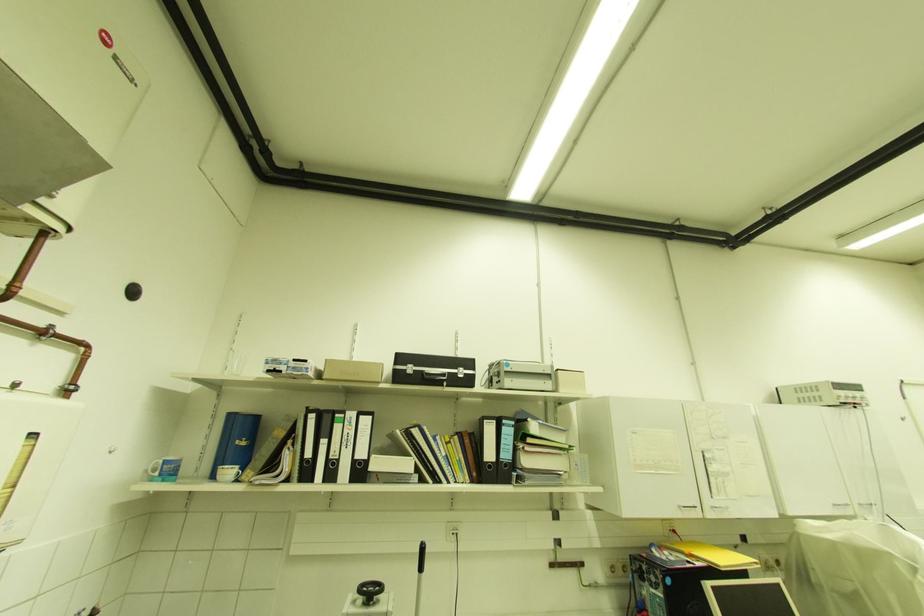
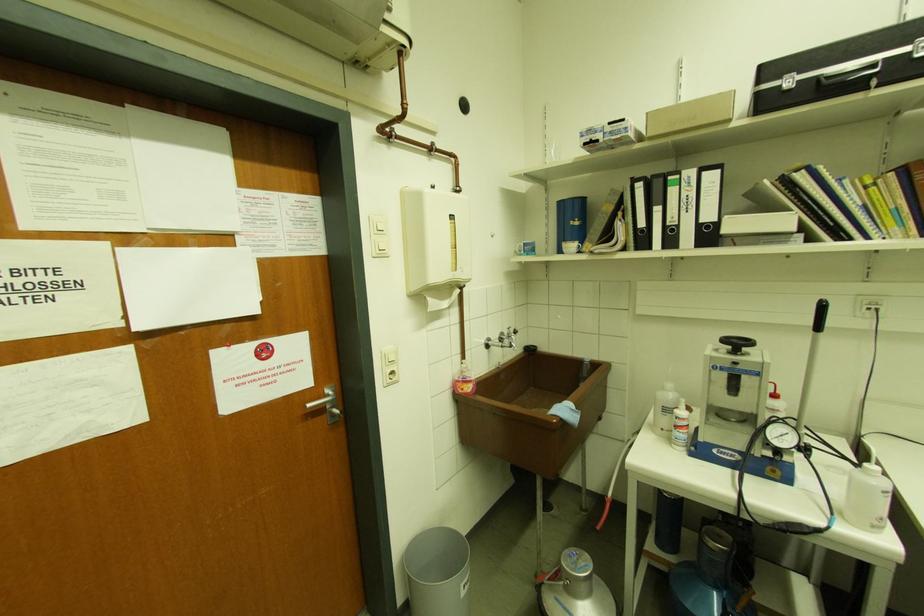
In the second image, find the point that corresponds to pixel 426 374 in the first image.

(821, 79)